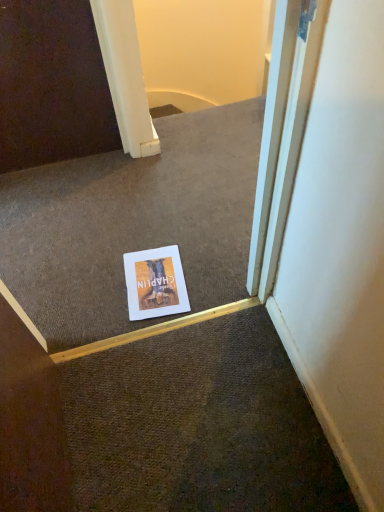
The width and height of the screenshot is (384, 512). In order to click on vacant space underneath white paper at center (from a real-world perspective) in this screenshot , I will do `click(153, 283)`.